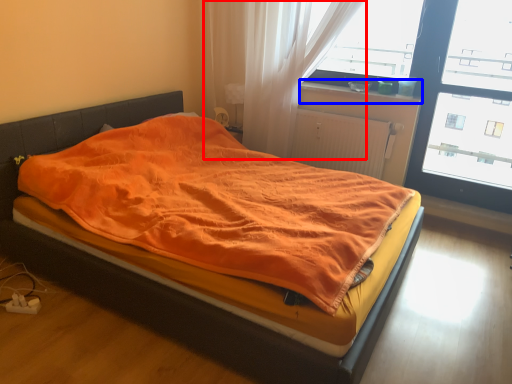
Question: Among these objects, which one is farthest to the camera, curtain (highlighted by a red box) or window sill (highlighted by a blue box)?

Choices:
 (A) curtain
 (B) window sill

Answer: (B)